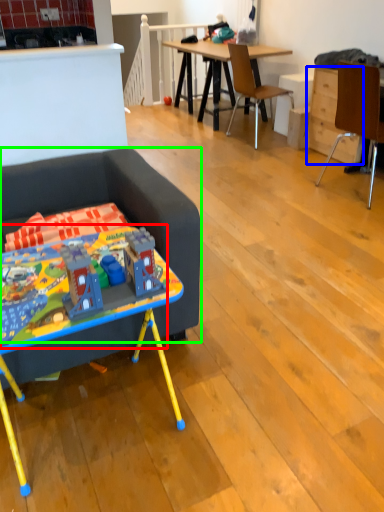
Question: Estimate the real-world distances between objects in this image. Which object is farther from toy (highlighted by a red box), drawer (highlighted by a blue box) or studio couch (highlighted by a green box)?

Choices:
 (A) drawer
 (B) studio couch

Answer: (A)